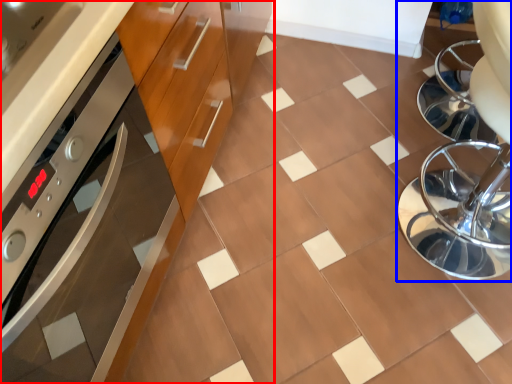
Question: Which point is closer to the camera, cabinetry (highlighted by a red box) or swivel chair (highlighted by a blue box)?

Choices:
 (A) cabinetry
 (B) swivel chair

Answer: (A)